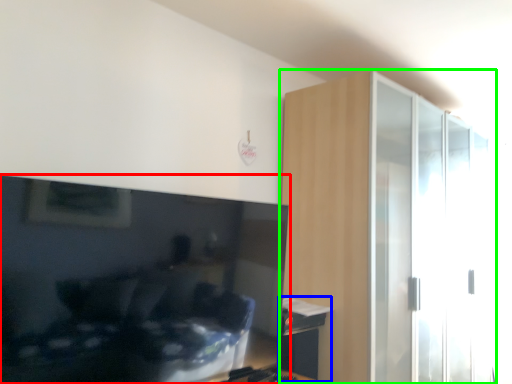
Question: Which is nearer to the television (highlighted by a red box)? table (highlighted by a blue box) or dresser (highlighted by a green box).

Choices:
 (A) table
 (B) dresser

Answer: (A)